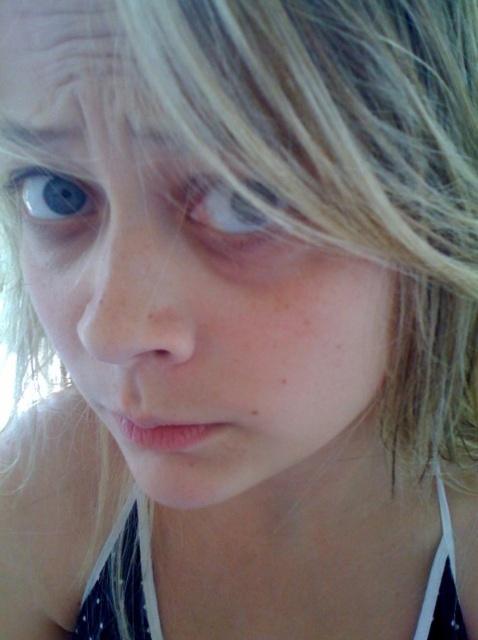
Is translucent skin eye at center taller than brown matte freckle at lower center?

Yes, translucent skin eye at center is taller than brown matte freckle at lower center.

Between point (249, 212) and point (249, 413), which one is positioned in front?

Point (249, 212) is in front.

This screenshot has width=478, height=640. What are the coordinates of `translucent skin eye at center` in the screenshot? It's located at (221, 208).

Between translucent skin eye at center and blue matte eye at upper left, which one is positioned higher?

blue matte eye at upper left is above.

Does translucent skin eye at center appear over blue matte eye at upper left?

Incorrect, translucent skin eye at center is not positioned above blue matte eye at upper left.

Who is more distant from viewer, [264,202] or [94,208]?

The point [94,208] is behind.

Locate an element on the screen. translucent skin eye at center is located at coordinates (221, 208).

Between white dotted fabric bikini top at lower center and brown matte freckle at lower center, which one appears on the right side from the viewer's perspective?

brown matte freckle at lower center

The image size is (478, 640). Describe the element at coordinates (122, 580) in the screenshot. I see `white dotted fabric bikini top at lower center` at that location.

Which is in front, point (140, 620) or point (249, 406)?

Positioned in front is point (249, 406).

Find the location of a particular element. white dotted fabric bikini top at lower center is located at coordinates (122, 580).